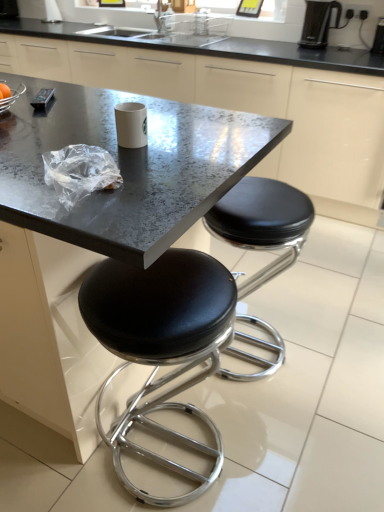
Identify the location of vacant space in front of white glossy paper cup at center. Image resolution: width=384 pixels, height=512 pixels. (161, 161).